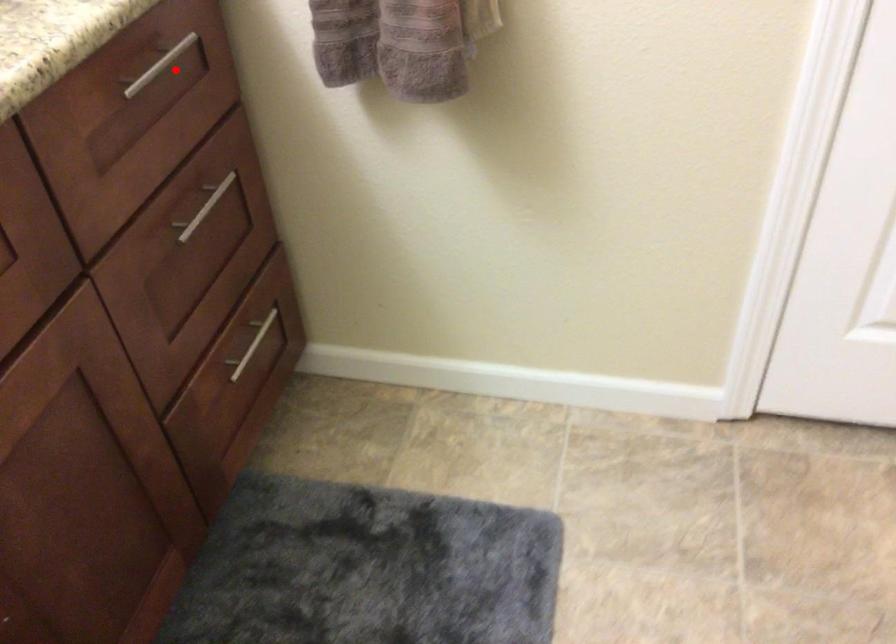
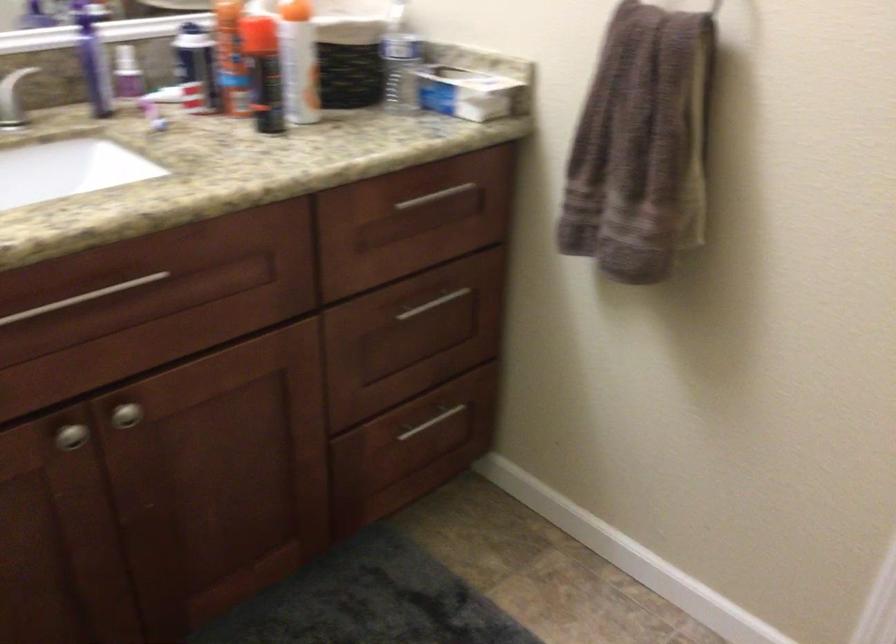
Locate, in the second image, the point that corresponds to the highlighted location in the first image.

(445, 201)